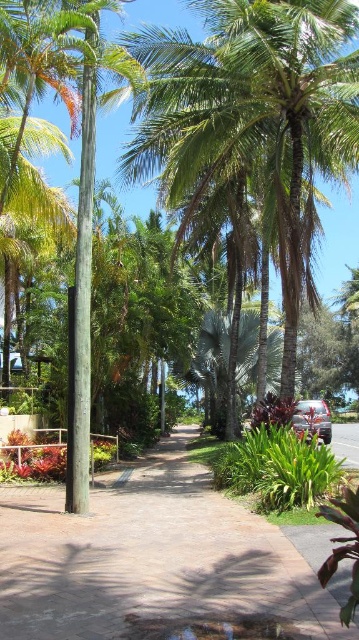
You are a gardener planning to place a new decorative statue on the tropical pathway. The statue requires a flat, stable surface. Given the brown concrete pavement at center and the metallic silver car at center, which object would be more suitable for placing the statue?

The brown concrete pavement at center is more suitable for placing the statue because it is a stable surface, unlike the metallic silver car at center which is likely a temporary object.

You are a gardener standing on the tropical pathway. You see the green leafy palm tree at center and the green matte pole at center. Which object is higher from the ground?

The green leafy palm tree at center is above the green matte pole at center, so it is higher from the ground.

You are standing at the start of the tropical pathway and see two points marked on the path. The first point is at coordinates point (299, 189) and the second is at point (305, 401). Which point is closer to you as you walk along the path?

Point (299, 189) is in front of point (305, 401), so it is closer to you as you walk along the path.